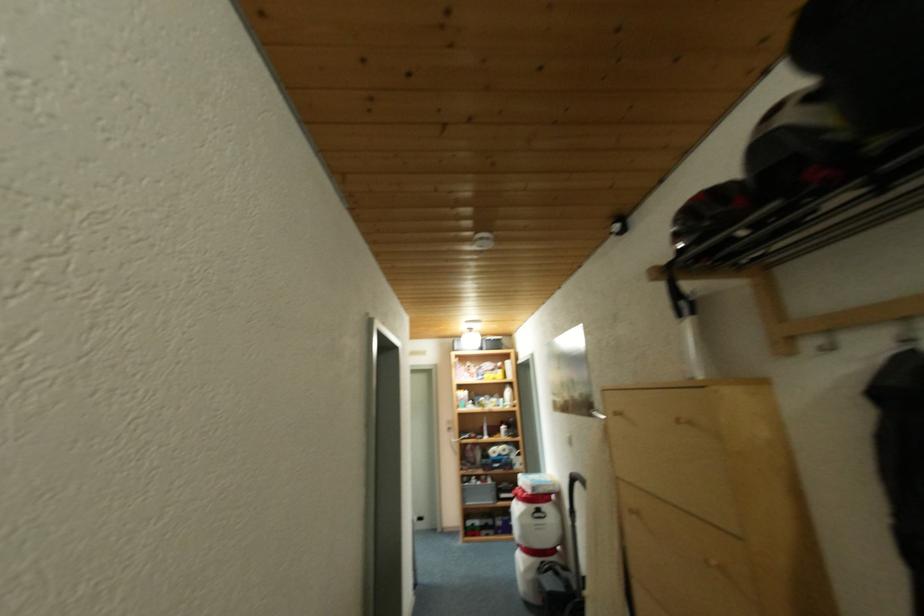
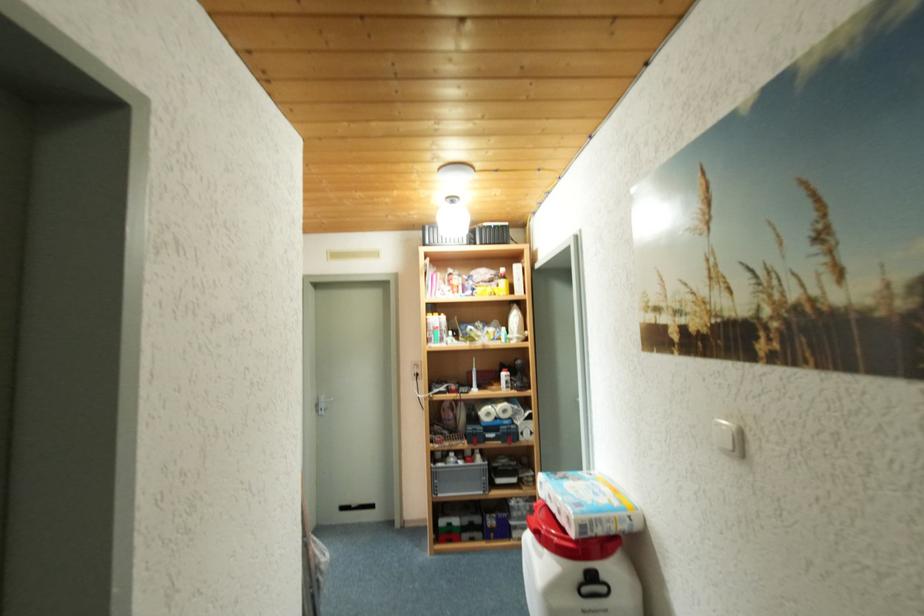
Question: In a continuous first-person perspective shot, in which direction is the camera moving?

Choices:
 (A) Left
 (B) Right
 (C) Forward
 (D) Backward

Answer: (C)